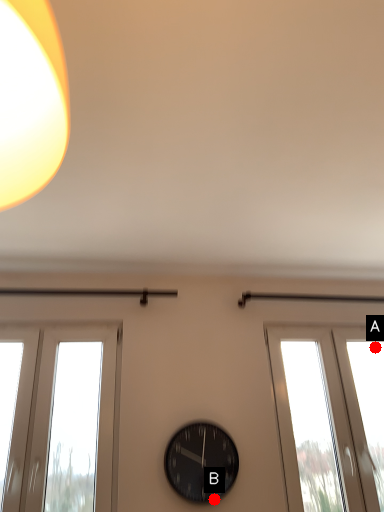
Question: Two points are circled on the image, labeled by A and B beside each circle. Which of the following is the closest to the observer?

Choices:
 (A) A is closer
 (B) B is closer

Answer: (B)